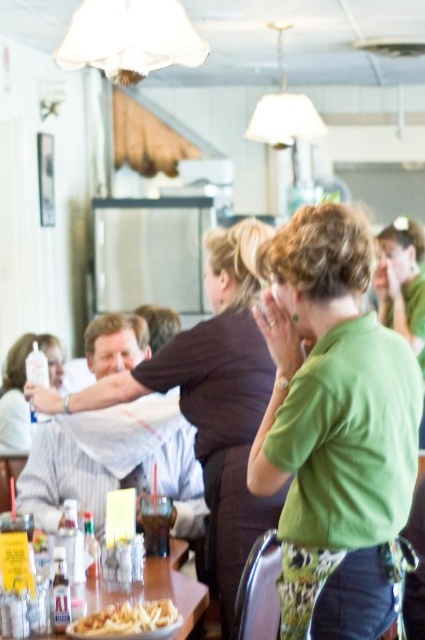
Describe the element at coordinates (334, 428) in the screenshot. This screenshot has width=425, height=640. I see `green matte shirt at center` at that location.

Identify the location of green matte shirt at center. This screenshot has width=425, height=640. (334, 428).

Does green matte shirt at center have a greater width compared to wooden table at lower left?

No, green matte shirt at center is not wider than wooden table at lower left.

This screenshot has height=640, width=425. Describe the element at coordinates (334, 428) in the screenshot. I see `green matte shirt at center` at that location.

Where is `green matte shirt at center`? green matte shirt at center is located at coordinates (334, 428).

Is green matte shirt at center wider than matte brown shirt at center?

Incorrect, green matte shirt at center's width does not surpass matte brown shirt at center's.

Can you confirm if green matte shirt at center is positioned below matte brown shirt at center?

No, green matte shirt at center is not below matte brown shirt at center.

The image size is (425, 640). Describe the element at coordinates (334, 428) in the screenshot. I see `green matte shirt at center` at that location.

At what (x,y) coordinates should I click in order to perform the action: click on green matte shirt at center. Please return your answer as a coordinate pair (x, y). Image resolution: width=425 pixels, height=640 pixels. Looking at the image, I should click on (334, 428).